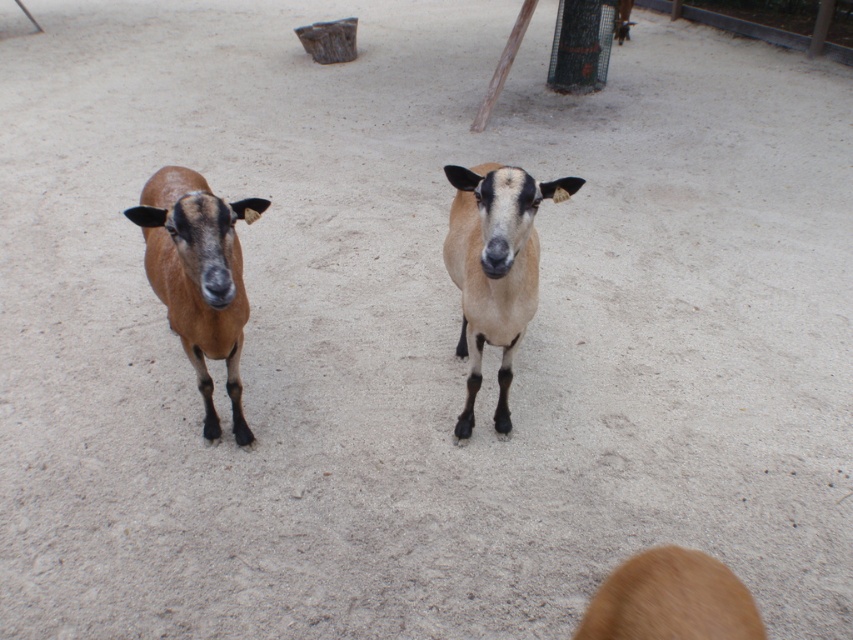
You are a photographer trying to capture both points in the image. Which point, point (457,435) or point (590,621), is closer to your camera lens?

Point (590,621) is closer to the camera lens because it is less further than point (457,435).

You are a photographer trying to capture both the brown matte goat at left and the light brown fur goat at center in the same frame. Based on their positions, which goat appears lower in the photo?

The brown matte goat at left appears lower in the photo because it is positioned below the light brown fur goat at center.